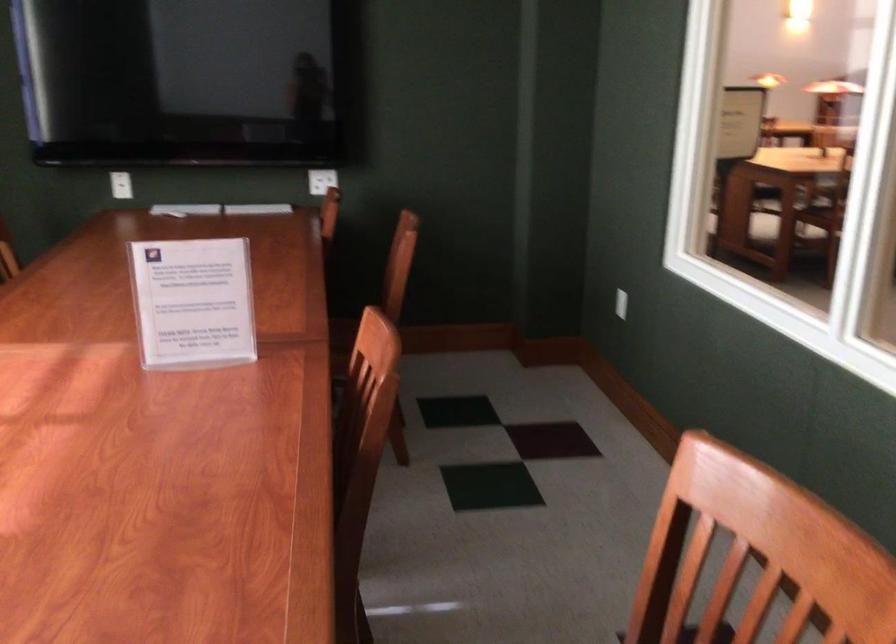
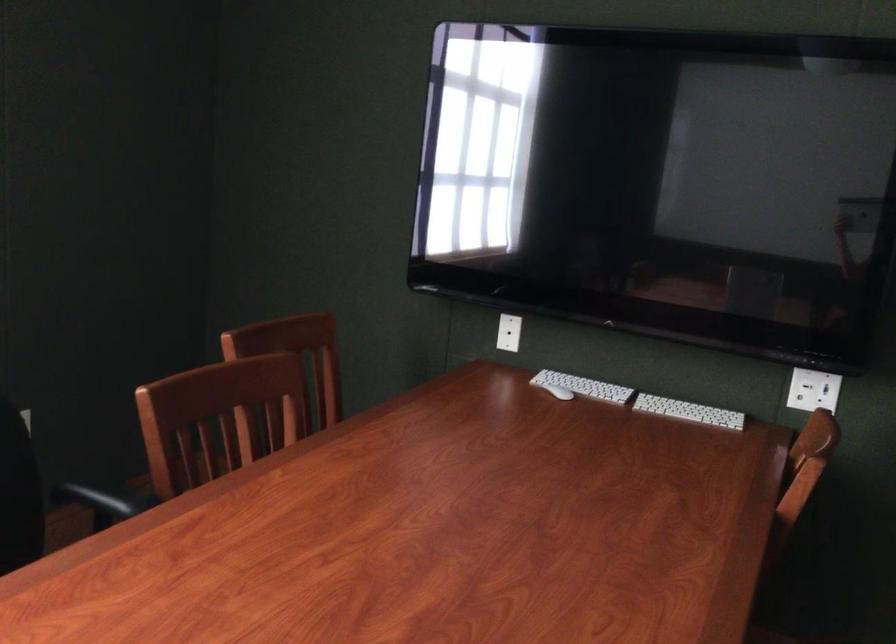
Locate, in the second image, the point that corresponds to (x=126, y=181) in the first image.

(509, 333)